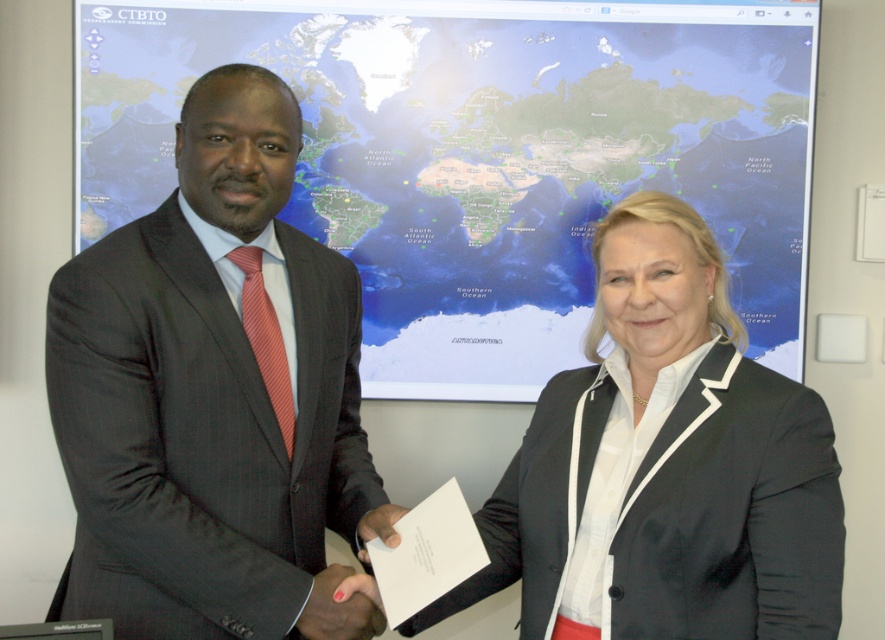
Is dark gray suit at left to the left of matte black hand at center from the viewer's perspective?

Correct, you'll find dark gray suit at left to the left of matte black hand at center.

Is point (272, 436) positioned behind point (395, 508)?

That is False.

Locate an element on the screen. dark gray suit at left is located at coordinates (209, 388).

Can you confirm if matte black blazer at center is positioned to the left of matte black hand at center?

Incorrect, matte black blazer at center is not on the left side of matte black hand at center.

Where is `matte black blazer at center`? The height and width of the screenshot is (640, 885). matte black blazer at center is located at coordinates (666, 467).

What do you see at coordinates (666, 467) in the screenshot? This screenshot has width=885, height=640. I see `matte black blazer at center` at bounding box center [666, 467].

You are a GUI agent. You are given a task and a screenshot of the screen. Output one action in this format:
    pyautogui.click(x=<x>, y=<y>)
    Task: Click on the matte black blazer at center
    This screenshot has height=640, width=885.
    Given the screenshot: What is the action you would take?
    pyautogui.click(x=666, y=467)

Looking at this image, does dark gray suit at left have a greater height compared to nail polish at center?

Correct, dark gray suit at left is much taller as nail polish at center.

Can you confirm if dark gray suit at left is wider than nail polish at center?

Indeed, dark gray suit at left has a greater width compared to nail polish at center.

Which is behind, point (68, 372) or point (329, 620)?

The point (329, 620) is behind.

I want to click on dark gray suit at left, so click(x=209, y=388).